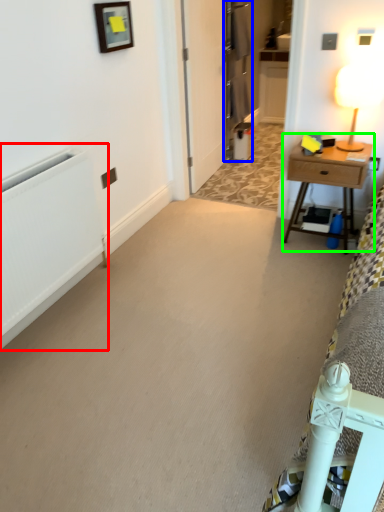
Question: Which object is positioned closest to radiator (highlighted by a red box)? Select from armoire (highlighted by a blue box) and nightstand (highlighted by a green box).

Choices:
 (A) armoire
 (B) nightstand

Answer: (B)